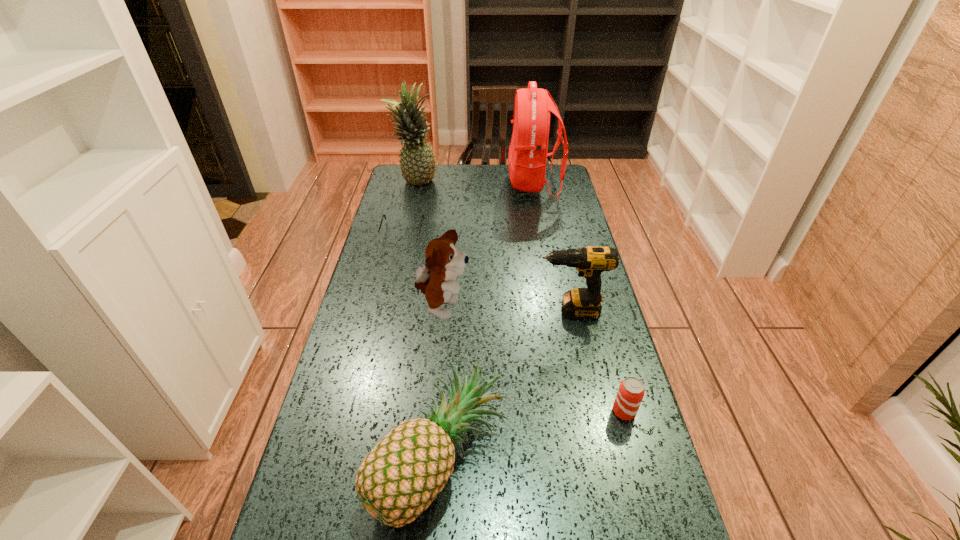
Locate an element on the screen. This screenshot has height=540, width=960. backpack is located at coordinates (527, 158).

Identify the location of the farther pineapple. [x=417, y=161].

Where is `puppy`? The width and height of the screenshot is (960, 540). puppy is located at coordinates (436, 279).

Where is `drill`? The width and height of the screenshot is (960, 540). drill is located at coordinates (582, 303).

This screenshot has width=960, height=540. What are the coordinates of `the sixth tallest object` in the screenshot? It's located at (631, 391).

I want to click on spectacles, so click(x=388, y=237).

Find the location of `the third farthest object`. the third farthest object is located at coordinates (388, 237).

Locate an element on the screen. This screenshot has width=960, height=540. vacant space situated on the main compartment of the backpack is located at coordinates (493, 185).

You are a GUI agent. You are given a task and a screenshot of the screen. Output one action in this format:
    pyautogui.click(x=<x>, y=<y>)
    Task: Click on the vacant region located on the main compartment of the backpack
    This screenshot has height=540, width=960.
    Given the screenshot: What is the action you would take?
    pyautogui.click(x=449, y=185)

Locate an element on the screen. This screenshot has width=960, height=540. vacant space located on the main compartment of the backpack is located at coordinates (454, 185).